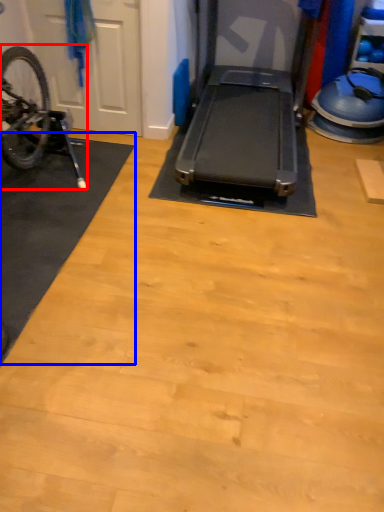
Question: Which object is further to the camera taking this photo, bicycle (highlighted by a red box) or mat (highlighted by a blue box)?

Choices:
 (A) bicycle
 (B) mat

Answer: (A)